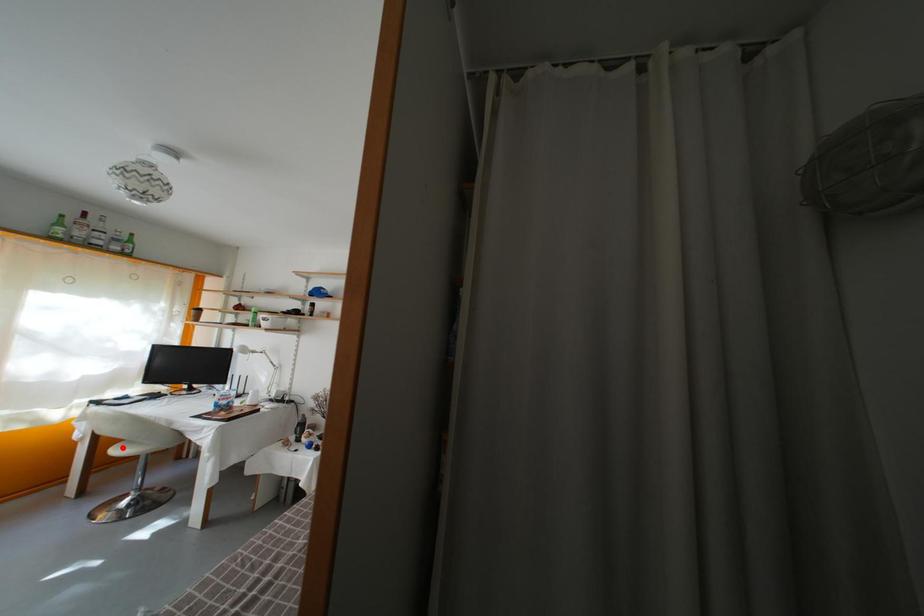
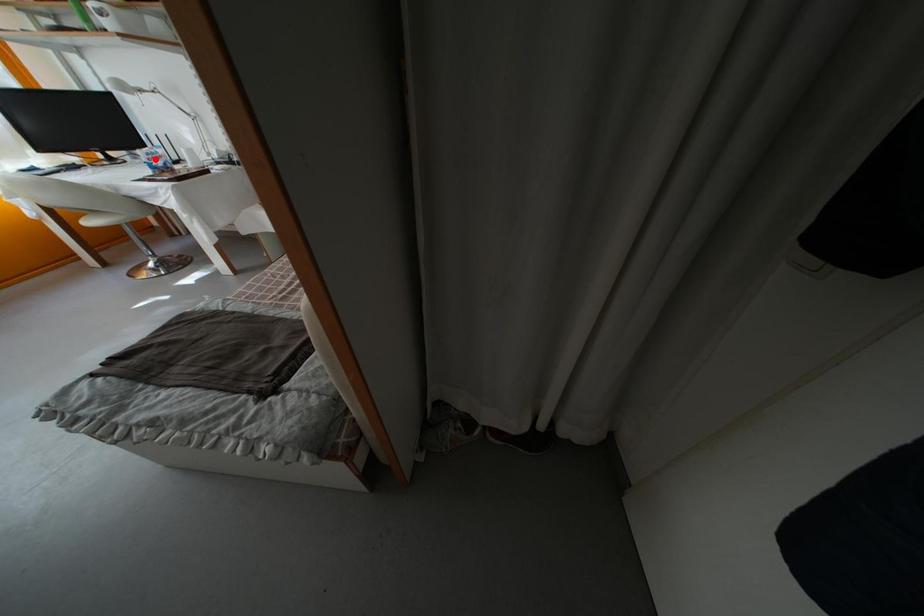
I am providing you with two images of the same scene from different viewpoints. A red point is marked on the first image and another point is marked on the second image. Is the red point in image1 aligned with the point shown in image2?

No